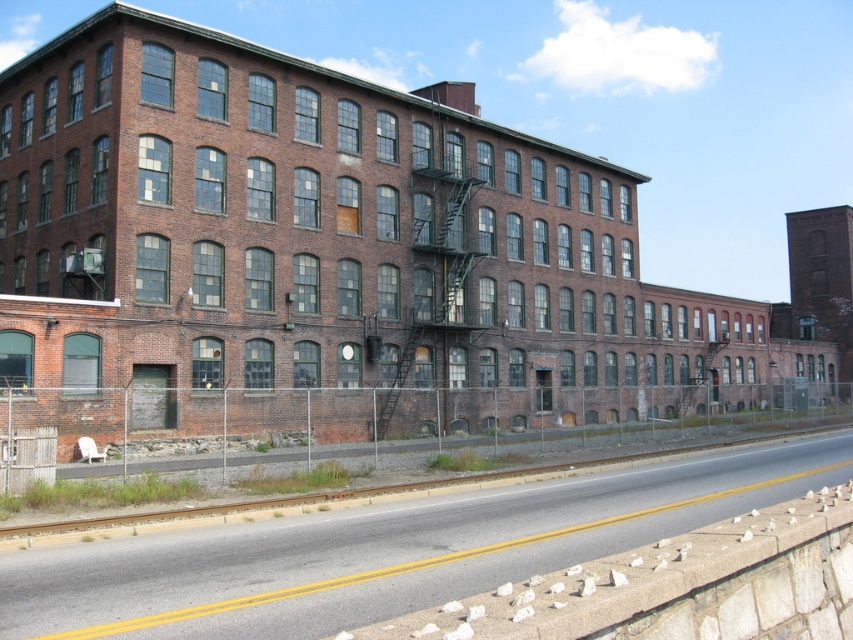
You are standing on the paved road in front of the large brick building. You want to walk directly towards the point marked at coordinates point [612,294]. How far will you have to walk to reach that point?

The point [612,294] is 51.00 meters away from the viewer, so you will have to walk 51.00 meters to reach it.

You are a train engineer approaching the brick building at center and the smooth asphalt train track at lower center. Which object is wider from your perspective?

The brick building at center is wider than the smooth asphalt train track at lower center.